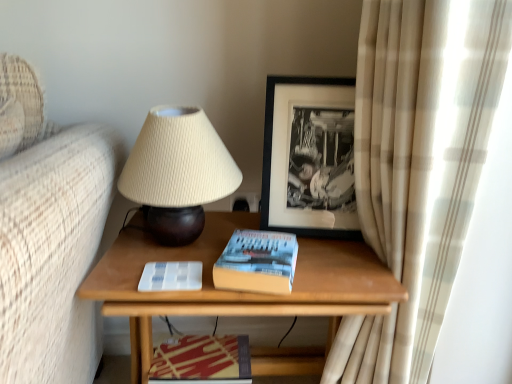
At what (x,y) coordinates should I click in order to perform the action: click on vacant space underneath beige ribbed fabric lampshade at upper center (from a real-world perspective). Please return your answer as a coordinate pair (x, y). Looking at the image, I should click on (183, 241).